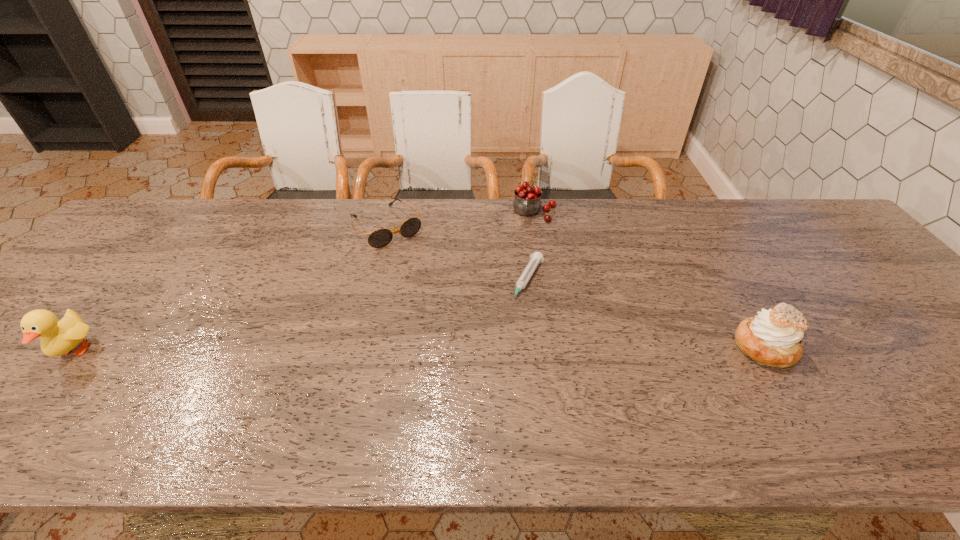
Choose which object is the nearest neighbor to the shortest object. Please provide its 2D coordinates. Your answer should be formatted as a tuple, i.e. [(x, y)], where the tuple contains the x and y coordinates of a point satisfying the conditions above.

[(527, 201)]

This screenshot has width=960, height=540. In order to click on vacant space that satisfies the following two spatial constraints: 1. on the front side of the sunglasses; 2. on the right side of the third farthest object in this screenshot , I will do `click(372, 281)`.

Where is `free region that satisfies the following two spatial constraints: 1. on the back side of the third nearest object; 2. on the right side of the pot filled with cherries`? This screenshot has width=960, height=540. free region that satisfies the following two spatial constraints: 1. on the back side of the third nearest object; 2. on the right side of the pot filled with cherries is located at coordinates (519, 212).